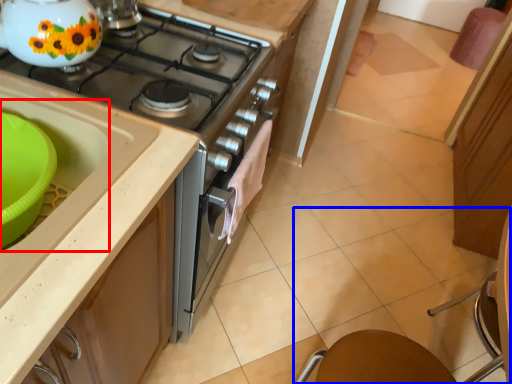
Question: Which of the following is the closest to the observer, sink (highlighted by a red box) or chair (highlighted by a blue box)?

Choices:
 (A) sink
 (B) chair

Answer: (B)